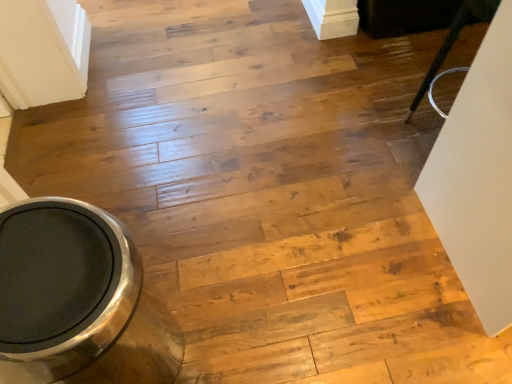
Locate an element on the screen. Image resolution: width=512 pixels, height=384 pixels. vacant area to the right of polished stainless steel toilet bowl at lower left is located at coordinates (236, 322).